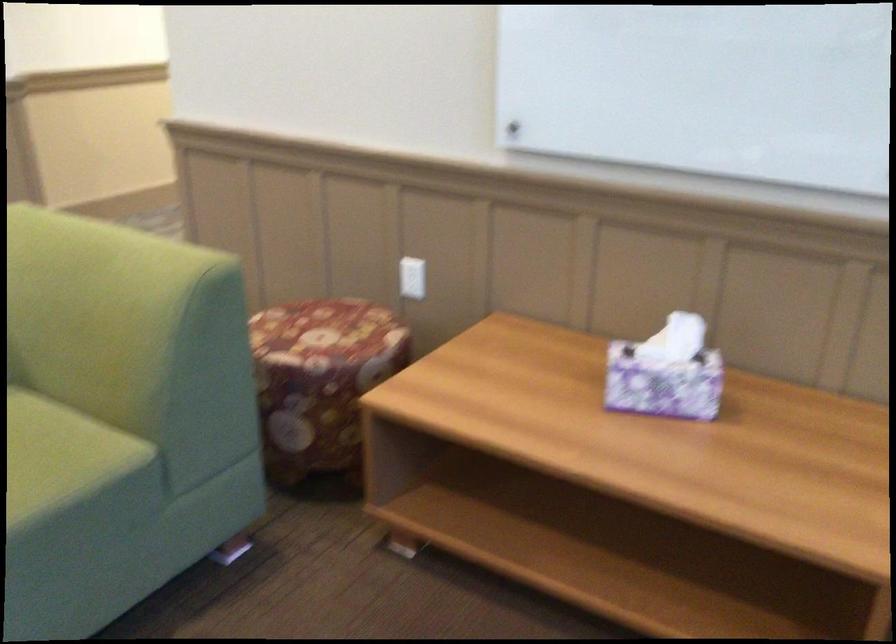
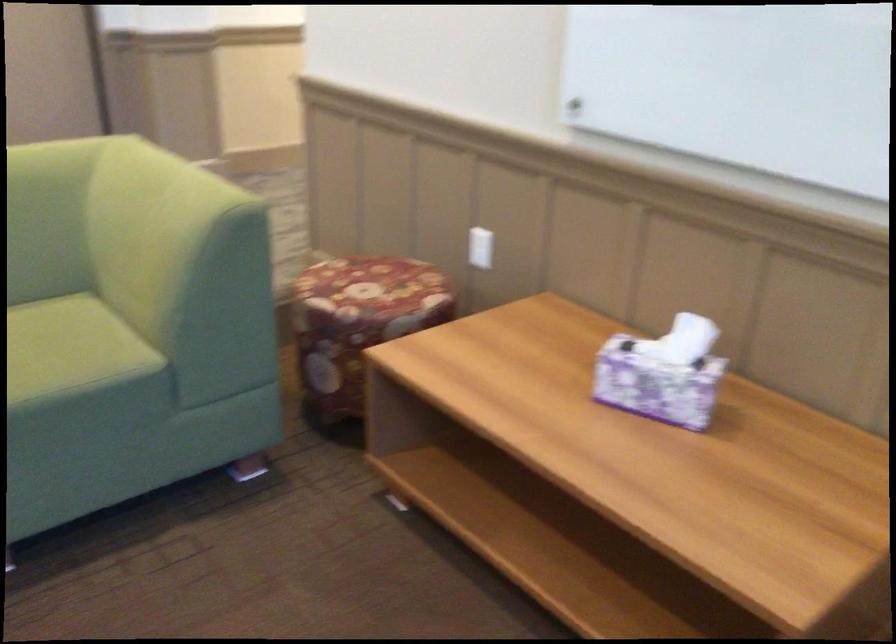
The point at (323, 333) is marked in the first image. Where is the corresponding point in the second image?

(372, 286)